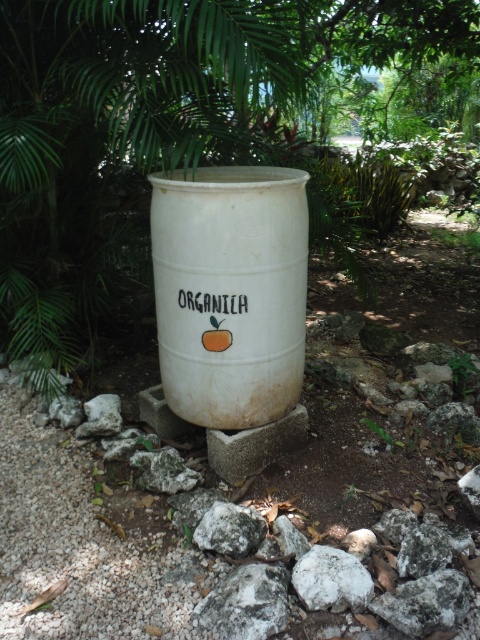
Question: Does green leafy tree at upper center have a lesser width compared to white matte rock at center?

Choices:
 (A) yes
 (B) no

Answer: (B)

Question: Is green leafy tree at upper center positioned at the back of white matte barrel at center?

Choices:
 (A) yes
 (B) no

Answer: (B)

Question: Which of the following is the farthest from the observer?

Choices:
 (A) (195, 529)
 (B) (367, 593)

Answer: (A)

Question: Which point is farther to the camera?

Choices:
 (A) green leafy tree at upper center
 (B) white matte barrel at center
 (C) white matte rock at center
 (D) white rough rock at center

Answer: (B)

Question: Does white matte rock at center have a larger size compared to white rough rock at center?

Choices:
 (A) yes
 (B) no

Answer: (B)

Question: Considering the real-world distances, which object is closest to the white matte barrel at center?

Choices:
 (A) white matte rock at center
 (B) white rough rock at center

Answer: (B)